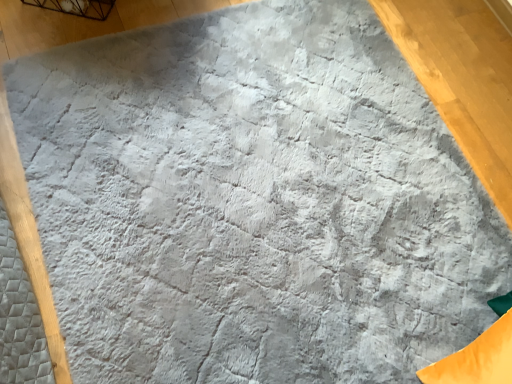
In order to click on orange fabric bean bag chair at lower right in this screenshot , I will do `click(479, 353)`.

The height and width of the screenshot is (384, 512). What do you see at coordinates (479, 353) in the screenshot?
I see `orange fabric bean bag chair at lower right` at bounding box center [479, 353].

Image resolution: width=512 pixels, height=384 pixels. Find the location of `orange fabric bean bag chair at lower right`. orange fabric bean bag chair at lower right is located at coordinates (479, 353).